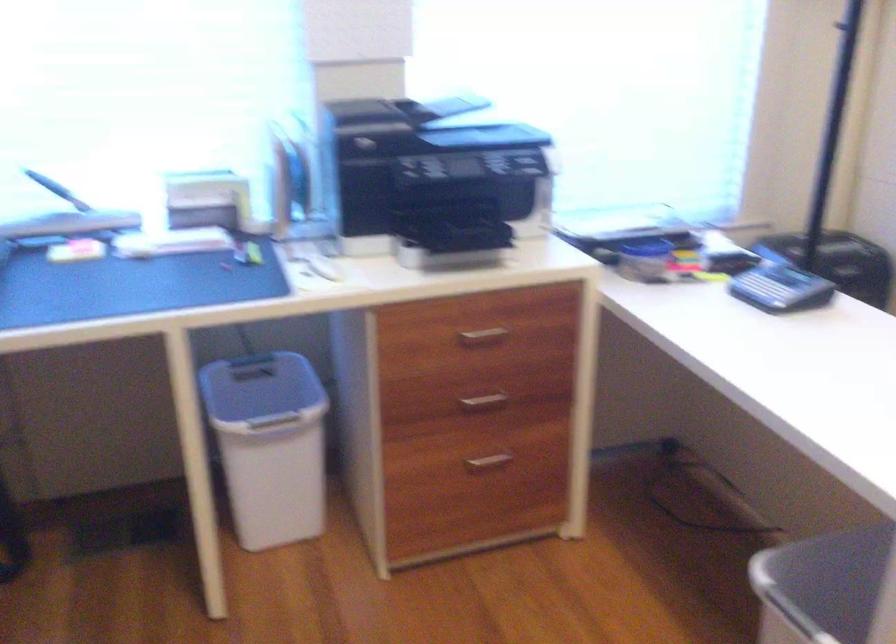
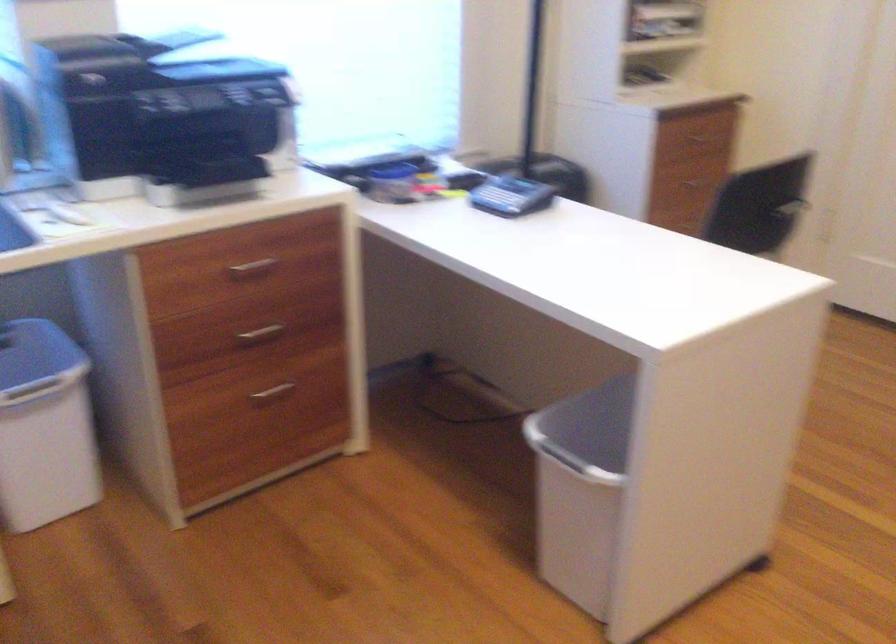
Question: Based on the continuous images, in which direction is the camera rotating? Reply with the corresponding letter.

Choices:
 (A) Left
 (B) Right
 (C) Up
 (D) Down

Answer: (B)